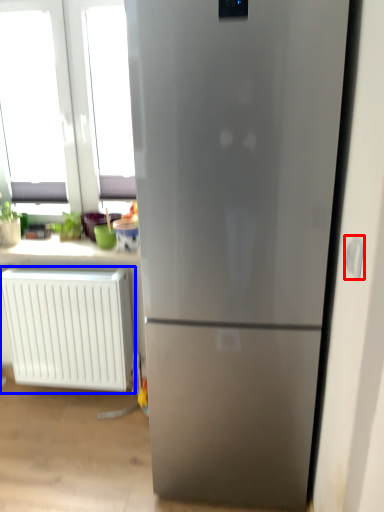
Question: Which point is further to the camera, electric outlet (highlighted by a red box) or radiator (highlighted by a blue box)?

Choices:
 (A) electric outlet
 (B) radiator

Answer: (B)